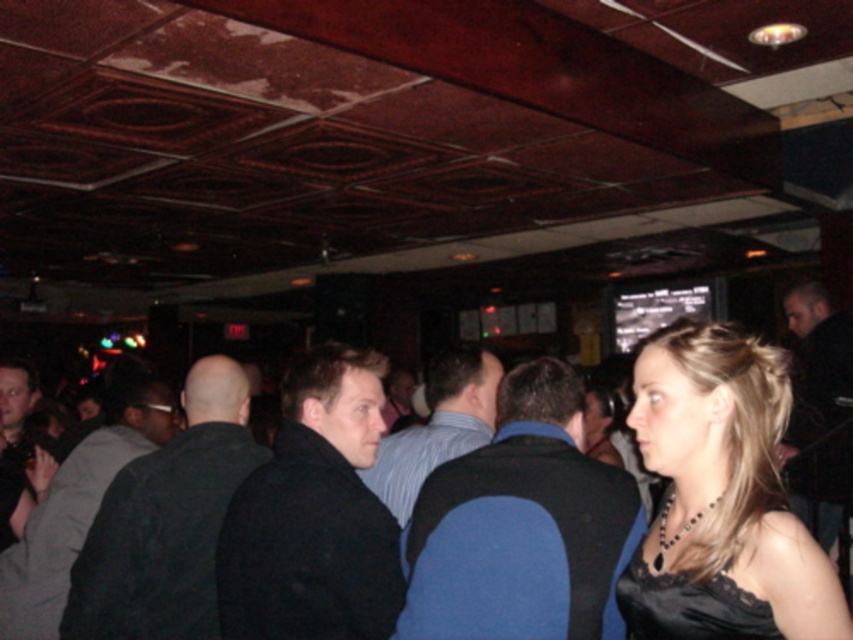
Question: Which point is closer to the camera?

Choices:
 (A) black matte jacket at center
 (B) dark gray sweater at center

Answer: (A)

Question: Does dark gray sweater at center appear over dark blue shirt at center?

Choices:
 (A) yes
 (B) no

Answer: (B)

Question: Does black matte jacket at center have a greater width compared to black matte vest at center?

Choices:
 (A) no
 (B) yes

Answer: (A)

Question: Can you confirm if black matte jacket at center is positioned above black matte vest at center?

Choices:
 (A) no
 (B) yes

Answer: (B)

Question: Which object is closer to the camera taking this photo?

Choices:
 (A) black lace dress at lower right
 (B) blue fabric vest at center

Answer: (A)

Question: Which is farther from the dark gray vest at center?

Choices:
 (A) dark gray sweater at left
 (B) blue fabric vest at center

Answer: (B)